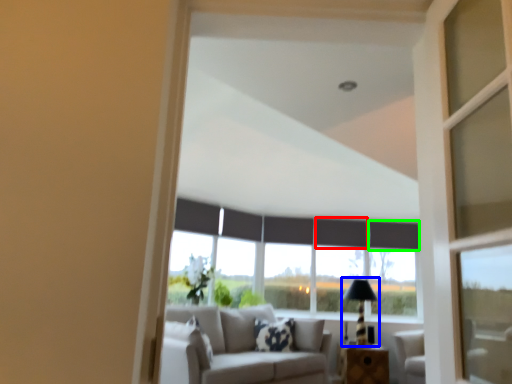
Question: Which object is positioned closest to curtain (highlighted by a red box)? Select from table lamp (highlighted by a blue box) and curtain (highlighted by a green box).

Choices:
 (A) table lamp
 (B) curtain

Answer: (B)